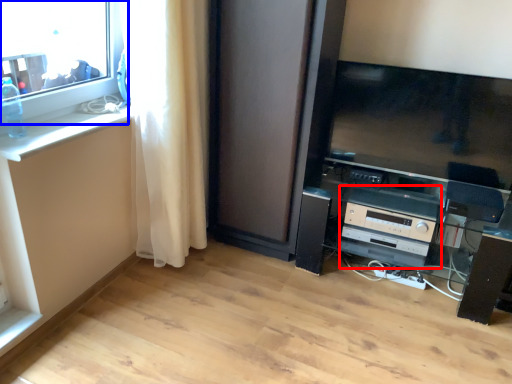
Question: Which of the following is the closest to the observer, appliance (highlighted by a red box) or window (highlighted by a blue box)?

Choices:
 (A) appliance
 (B) window

Answer: (B)